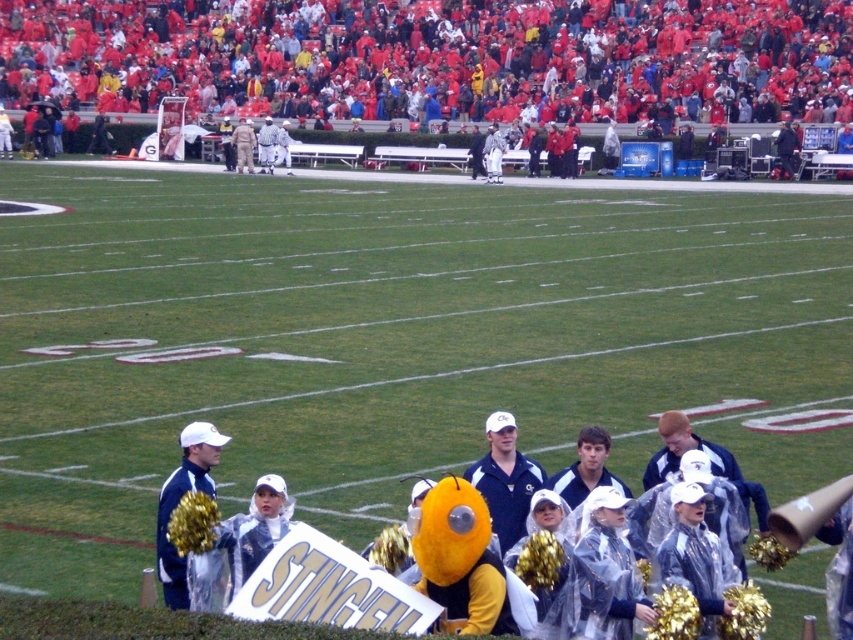
Does blue fabric jacket at center appear over blue fabric jacket at lower left?

No.

Between blue fabric jacket at center and blue fabric jacket at lower left, which one is positioned higher?

blue fabric jacket at lower left is above.

Who is more forward, (x=498, y=486) or (x=180, y=598)?

Point (x=180, y=598)

Find the location of `blue fabric jacket at center`. blue fabric jacket at center is located at coordinates (505, 477).

Is green grass field at center smaller than blue fabric jacket at center?

Incorrect, green grass field at center is not smaller in size than blue fabric jacket at center.

Does green grass field at center have a larger size compared to blue fabric jacket at center?

Yes, green grass field at center is bigger than blue fabric jacket at center.

Between point (547, 397) and point (512, 502), which one is positioned in front?

Point (512, 502) is more forward.

Where is `green grass field at center`? green grass field at center is located at coordinates (387, 342).

At what (x,y) coordinates should I click in order to perform the action: click on green grass field at center. Please return your answer as a coordinate pair (x, y). This screenshot has height=640, width=853. Looking at the image, I should click on (387, 342).

Can you confirm if green grass field at center is positioned below red fabric crowd at upper center?

Correct, green grass field at center is located below red fabric crowd at upper center.

Who is more forward, (323,468) or (91,33)?

Point (323,468) is in front.

In order to click on green grass field at center in this screenshot , I will do `click(387, 342)`.